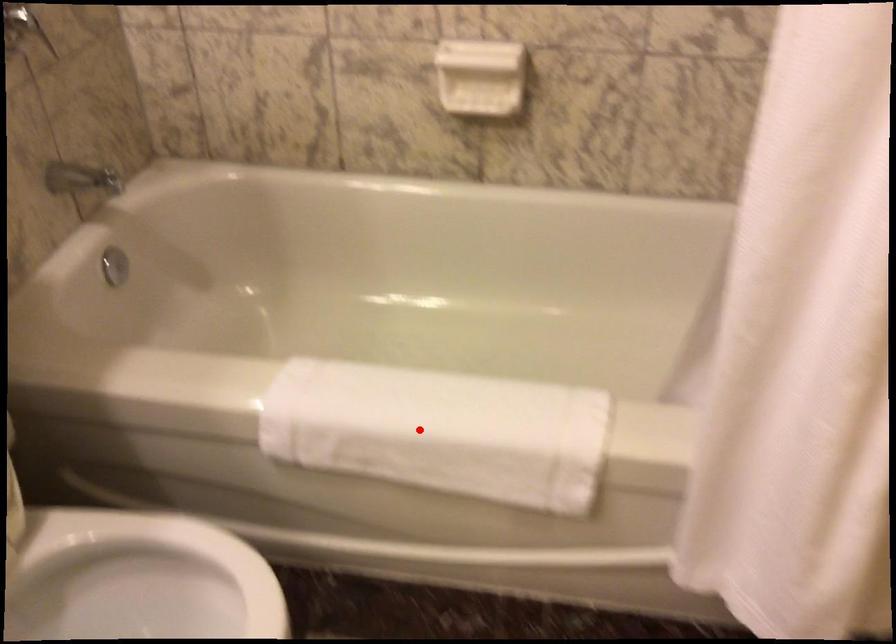
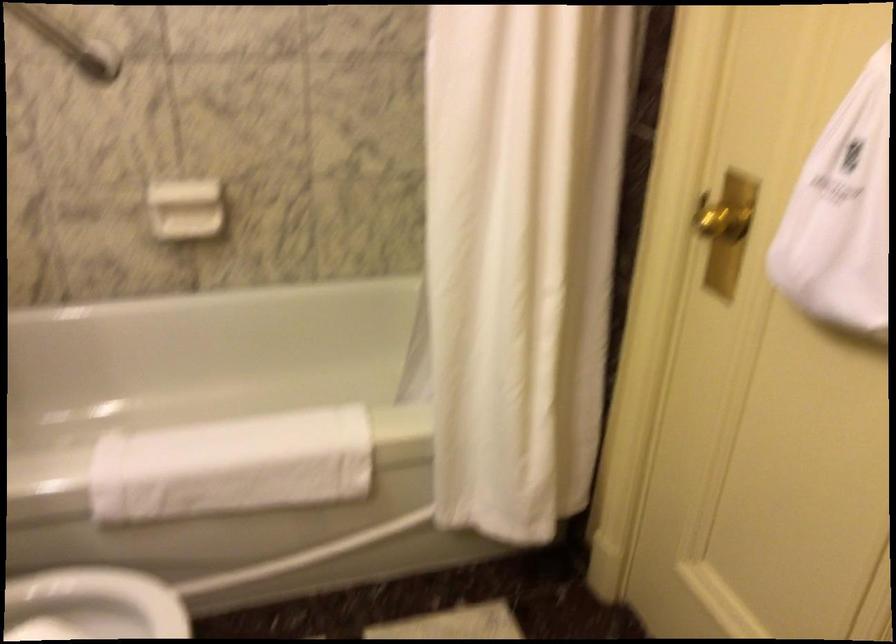
Question: I am providing you with two images of the same scene from different viewpoints. In image1, a red point is highlighted. Considering the same 3D point in image2, which of the following is correct?

Choices:
 (A) It is closer
 (B) It is farther

Answer: (B)